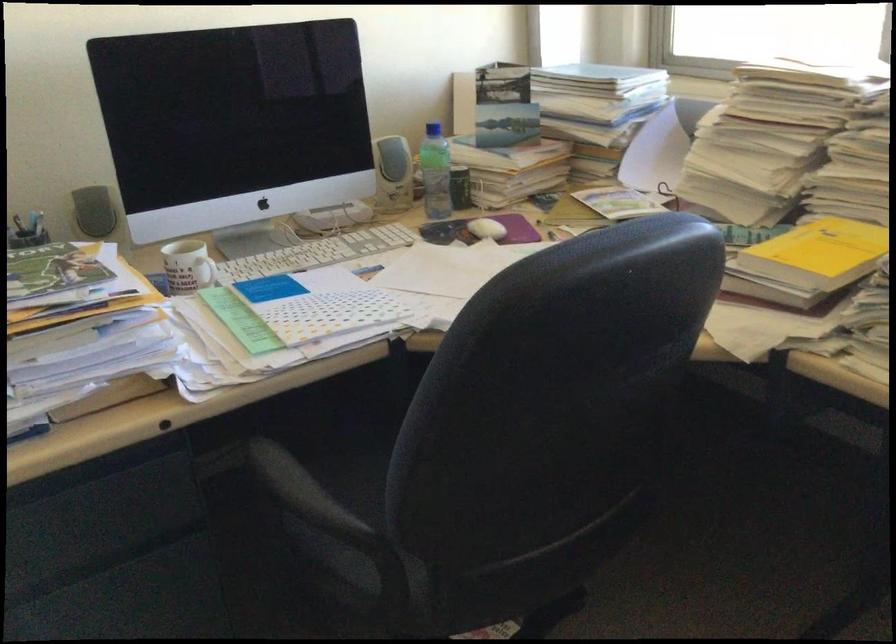
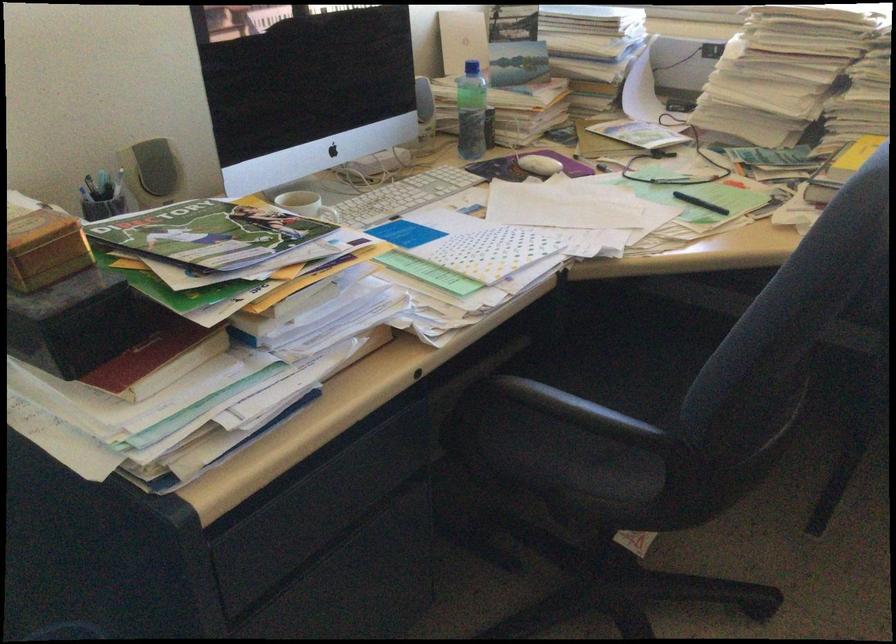
Where in the second image is the point corresponding to the point at 425,172 from the first image?

(470, 111)